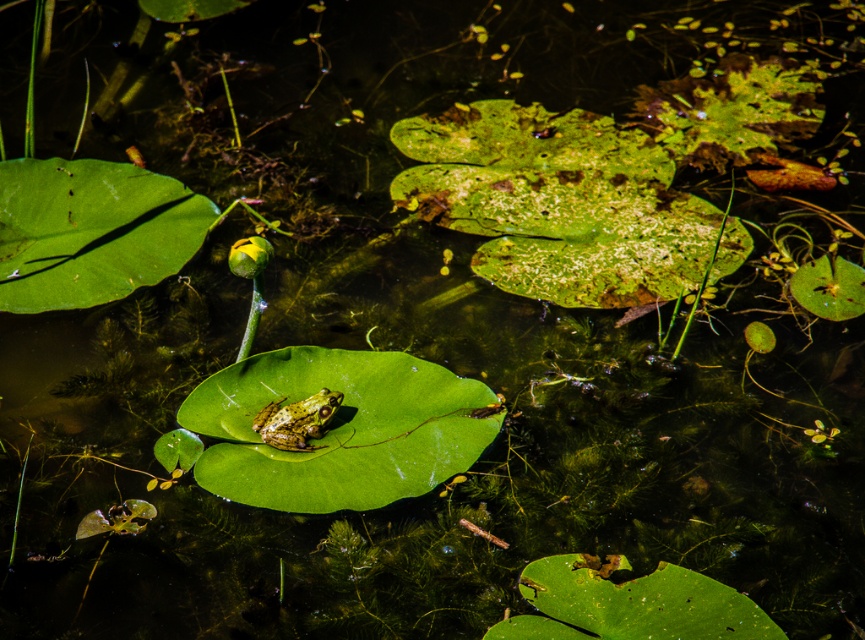
Question: In this image, where is green matte leaf at center located relative to speckled green frog at center?

Choices:
 (A) right
 (B) left

Answer: (A)

Question: Among these points, which one is nearest to the camera?

Choices:
 (A) (226, 444)
 (B) (332, 397)

Answer: (B)

Question: Is green matte leaf at center above speckled green frog at center?

Choices:
 (A) no
 (B) yes

Answer: (A)

Question: From the image, what is the correct spatial relationship of green matte leaf at center in relation to speckled green frog at center?

Choices:
 (A) above
 (B) below

Answer: (B)

Question: Which of the following is the farthest from the observer?

Choices:
 (A) speckled green frog at center
 (B) green matte leaf at center

Answer: (A)